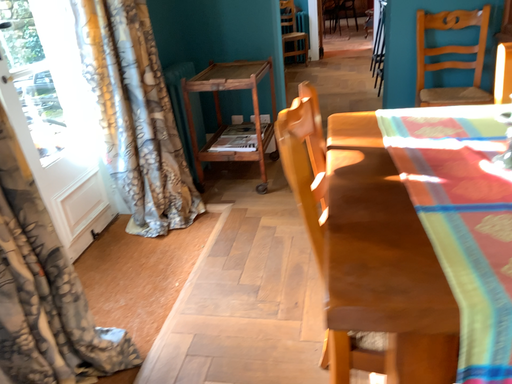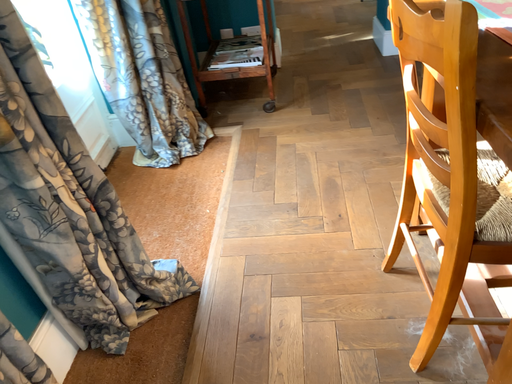
Question: Which way did the camera rotate in the video?

Choices:
 (A) rotated downward
 (B) rotated upward

Answer: (A)